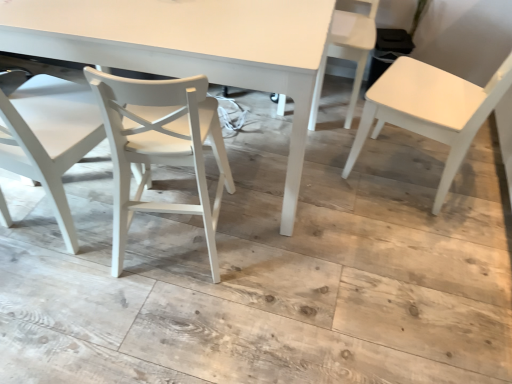
The image size is (512, 384). I want to click on vacant space in white matte chair at center, marked as the second chair in a left-to-right arrangement (from a real-world perspective), so click(170, 238).